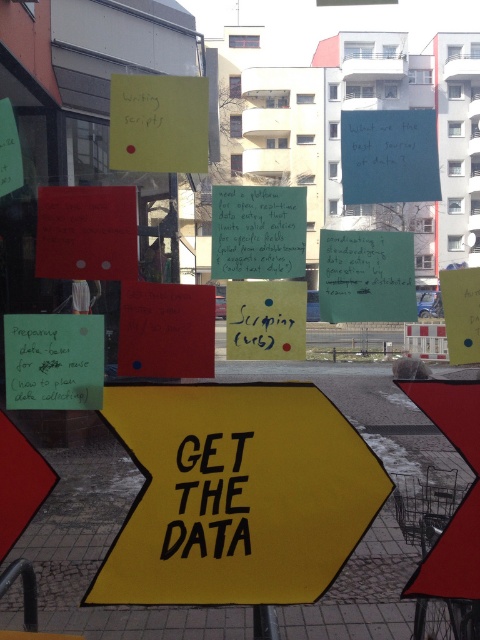
You are an interior designer planning to hang a small picture frame that is 10 cm wide. You see the green matte paper at center and the metallic pole at lower center. Which object can the frame be placed next to without overlapping, considering their sizes?

The green matte paper at center has a smaller size compared to metallic pole at lower center, so the frame can be placed next to the green matte paper at center without overlapping since it requires less space.

You are a customer standing in front of the window display. You see the yellow matte arrow at center and the black paper at center. Which object is positioned to the right side?

The black paper at center is positioned to the right of the yellow matte arrow at center.